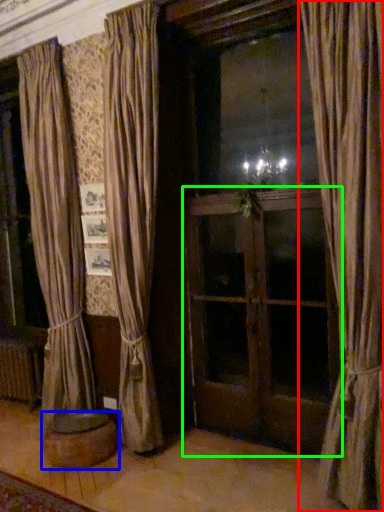
Question: Considering the real-world distances, which object is closest to curtain (highlighted by a red box)? furniture (highlighted by a blue box) or screen door (highlighted by a green box).

Choices:
 (A) furniture
 (B) screen door

Answer: (B)